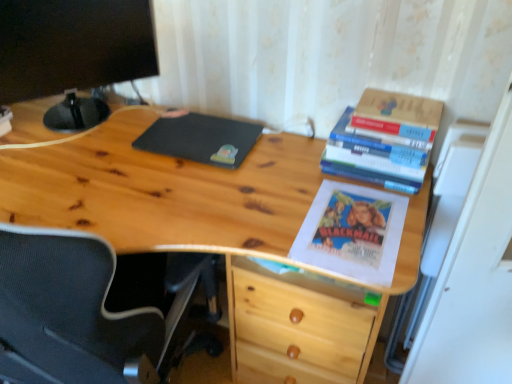
Question: Does black matte computer monitor at upper left appear on the left side of hardcover books at upper right, the 1th book when ordered from bottom to top?

Choices:
 (A) yes
 (B) no

Answer: (A)

Question: Is black matte computer monitor at upper left thinner than hardcover books at upper right, acting as the 2th book starting from the top?

Choices:
 (A) yes
 (B) no

Answer: (A)

Question: Considering the relative sizes of black matte computer monitor at upper left and hardcover books at upper right, the 1th book when ordered from bottom to top, in the image provided, is black matte computer monitor at upper left taller than hardcover books at upper right, the 1th book when ordered from bottom to top,?

Choices:
 (A) yes
 (B) no

Answer: (A)

Question: From a real-world perspective, is black matte computer monitor at upper left beneath hardcover books at upper right, the 1th book when ordered from bottom to top?

Choices:
 (A) no
 (B) yes

Answer: (A)

Question: Is black matte computer monitor at upper left with hardcover books at upper right, acting as the 2th book starting from the top?

Choices:
 (A) no
 (B) yes

Answer: (A)

Question: Does black matte computer monitor at upper left have a larger size compared to hardcover books at upper right, the 1th book when ordered from bottom to top?

Choices:
 (A) no
 (B) yes

Answer: (B)

Question: Considering the relative sizes of black matte mousepad at center and hardcover book at upper right, which appears as the first book when viewed from the top, in the image provided, is black matte mousepad at center thinner than hardcover book at upper right, which appears as the first book when viewed from the top,?

Choices:
 (A) no
 (B) yes

Answer: (A)

Question: Is black matte mousepad at center shorter than hardcover book at upper right, which appears as the first book when viewed from the top?

Choices:
 (A) yes
 (B) no

Answer: (A)

Question: Is the depth of black matte mousepad at center less than that of hardcover book at upper right, which is the second book in bottom-to-top order?

Choices:
 (A) no
 (B) yes

Answer: (A)

Question: Considering the relative sizes of black matte mousepad at center and hardcover book at upper right, which appears as the first book when viewed from the top, in the image provided, is black matte mousepad at center smaller than hardcover book at upper right, which appears as the first book when viewed from the top,?

Choices:
 (A) yes
 (B) no

Answer: (B)

Question: Can you confirm if black matte mousepad at center is wider than hardcover book at upper right, which appears as the first book when viewed from the top?

Choices:
 (A) yes
 (B) no

Answer: (A)

Question: Is the depth of black matte mousepad at center greater than that of hardcover book at upper right, which is the second book in bottom-to-top order?

Choices:
 (A) no
 (B) yes

Answer: (B)

Question: Is black matte mousepad at center taller than natural wood desk at center?

Choices:
 (A) yes
 (B) no

Answer: (B)